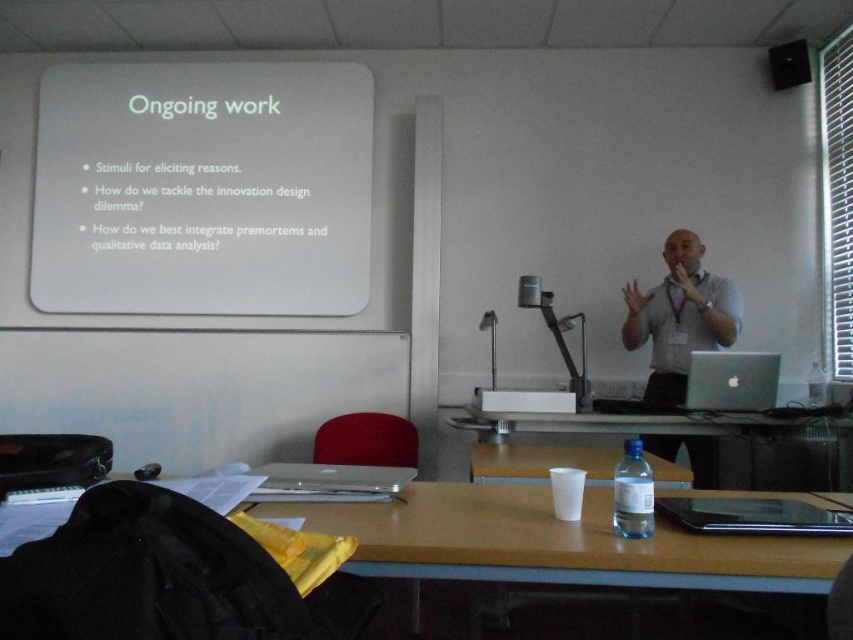
Who is more forward, (x=685, y=321) or (x=787, y=68)?

Point (x=685, y=321)

Between matte gray shirt at upper right and matte black speaker at upper right, which one is positioned lower?

matte gray shirt at upper right is below.

Find the location of a particular element. matte gray shirt at upper right is located at coordinates (679, 317).

Can you confirm if silver metallic laptop at center is positioned below sleek silver laptop at center?

No, silver metallic laptop at center is not below sleek silver laptop at center.

Who is shorter, silver metallic laptop at center or sleek silver laptop at center?

With less height is silver metallic laptop at center.

You are a GUI agent. You are given a task and a screenshot of the screen. Output one action in this format:
    pyautogui.click(x=<x>, y=<y>)
    Task: Click on the silver metallic laptop at center
    
    Given the screenshot: What is the action you would take?
    pyautogui.click(x=753, y=516)

I want to click on silver metallic laptop at center, so click(x=753, y=516).

Is silver metallic laptop at center closer to camera compared to white plastic projector at center?

That is True.

Between silver metallic laptop at center and white plastic projector at center, which one is positioned higher?

white plastic projector at center

Where is `silver metallic laptop at center`? silver metallic laptop at center is located at coordinates (753, 516).

Where is `silver metallic laptop at center`? The width and height of the screenshot is (853, 640). silver metallic laptop at center is located at coordinates (753, 516).